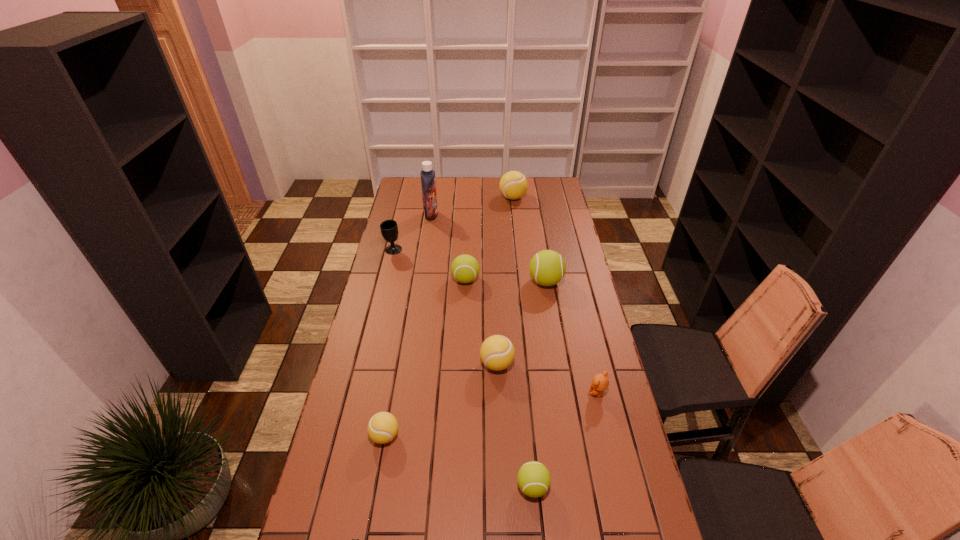
Where is `tennis ball located at the right edge`? The width and height of the screenshot is (960, 540). tennis ball located at the right edge is located at coordinates coord(547,267).

You are a GUI agent. You are given a task and a screenshot of the screen. Output one action in this format:
    pyautogui.click(x=<x>, y=<y>)
    Task: Click on the teddy bear located in the right edge section of the desktop
    The image size is (960, 540).
    Given the screenshot: What is the action you would take?
    pyautogui.click(x=600, y=382)

At what (x,y) coordinates should I click in order to perform the action: click on free space at the far edge of the desktop. Please return your answer as a coordinate pair (x, y). This screenshot has height=540, width=960. Looking at the image, I should click on 442,192.

The image size is (960, 540). Identify the location of blank space at the left edge of the desktop. (364, 459).

Where is `vacant space at the right edge of the desktop`? The height and width of the screenshot is (540, 960). vacant space at the right edge of the desktop is located at coordinates (617, 481).

This screenshot has height=540, width=960. What are the coordinates of `free spot between the chalice and the fourth farthest tennis ball` in the screenshot? It's located at (445, 307).

You are a GUI agent. You are given a task and a screenshot of the screen. Output one action in this format:
    pyautogui.click(x=<x>, y=<y>)
    Task: Click on the free spot between the fifth tennis ball from right to left and the biggest green tennis ball
    
    Given the screenshot: What is the action you would take?
    pyautogui.click(x=506, y=281)

Identify the location of vacant area that lies between the teddy bear and the nearest yellow tennis ball. (492, 414).

Find the location of a particular element. Image resolution: width=960 pixels, height=540 pixels. vacant space that's between the fourth nearest object and the third farthest object is located at coordinates (495, 321).

At what (x,y) coordinates should I click in order to perform the action: click on free spot between the brown teddy bear and the eighth nearest object. Please return your answer as a coordinate pair (x, y). Looking at the image, I should click on (495, 321).